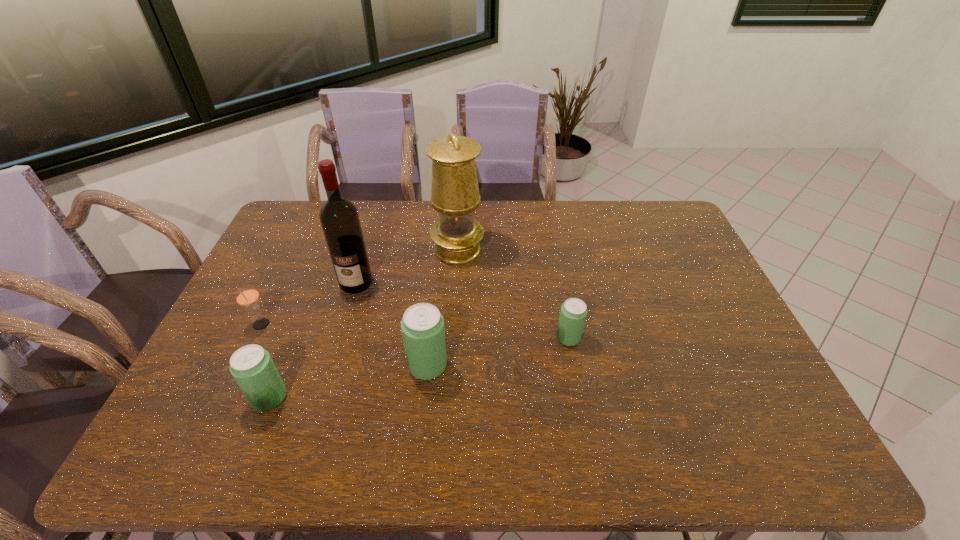
Locate an element on the screen. vacant position at the left edge of the desktop is located at coordinates (297, 264).

Locate an element on the screen. This screenshot has width=960, height=540. vacant space at the right edge of the desktop is located at coordinates (648, 253).

This screenshot has height=540, width=960. I want to click on free point between the third object from left to right and the leftmost object, so click(308, 304).

Find the location of a particular element. The height and width of the screenshot is (540, 960). free spot between the farthest object and the shortest soda is located at coordinates (513, 294).

Locate an element on the screen. The image size is (960, 540). vacant space that is in between the fourth object from right to left and the oil lamp is located at coordinates pos(407,266).

The image size is (960, 540). Find the location of `unoccupied position between the third object from left to right and the straw`. unoccupied position between the third object from left to right and the straw is located at coordinates (308, 304).

Locate an element on the screen. This screenshot has width=960, height=540. free spot between the farthest object and the shortest object is located at coordinates (513, 294).

The image size is (960, 540). In order to click on free spot between the tallest soda and the shortest object in this screenshot , I will do `click(498, 352)`.

Identify the location of vacant point located between the oil lamp and the second soda from right to left. (443, 308).

Find the location of `blank region between the straw and the alcohol`. blank region between the straw and the alcohol is located at coordinates (308, 304).